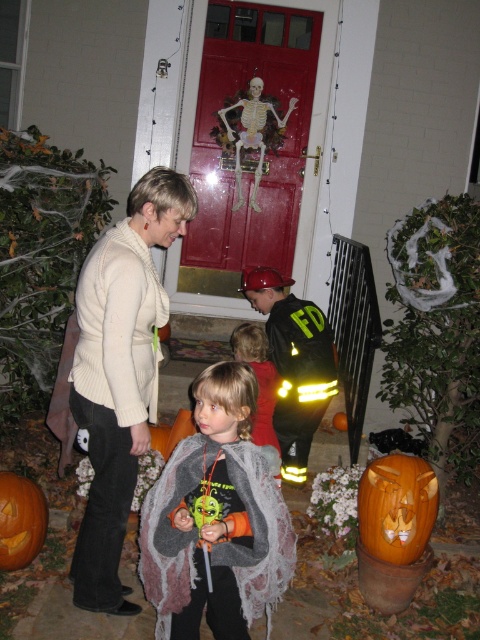
Question: Among these points, which one is farthest from the camera?

Choices:
 (A) (322, 339)
 (B) (338, 412)

Answer: (B)

Question: From the image, what is the correct spatial relationship of white sweater at center in relation to orange carved pumpkin at lower right?

Choices:
 (A) left
 (B) right

Answer: (A)

Question: Among these points, which one is farthest from the camera?

Choices:
 (A) (340, 419)
 (B) (178, 538)

Answer: (A)

Question: Can you confirm if reflective black fireman suit at center is wider than orange carved pumpkin at lower left?

Choices:
 (A) yes
 (B) no

Answer: (A)

Question: Is orange carved pumpkin at center to the left of orange matte pumpkin at center from the viewer's perspective?

Choices:
 (A) yes
 (B) no

Answer: (B)

Question: Which object is positioned farthest from the reflective black fireman suit at center?

Choices:
 (A) orange matte pumpkin at center
 (B) orange carved pumpkin at lower right

Answer: (A)